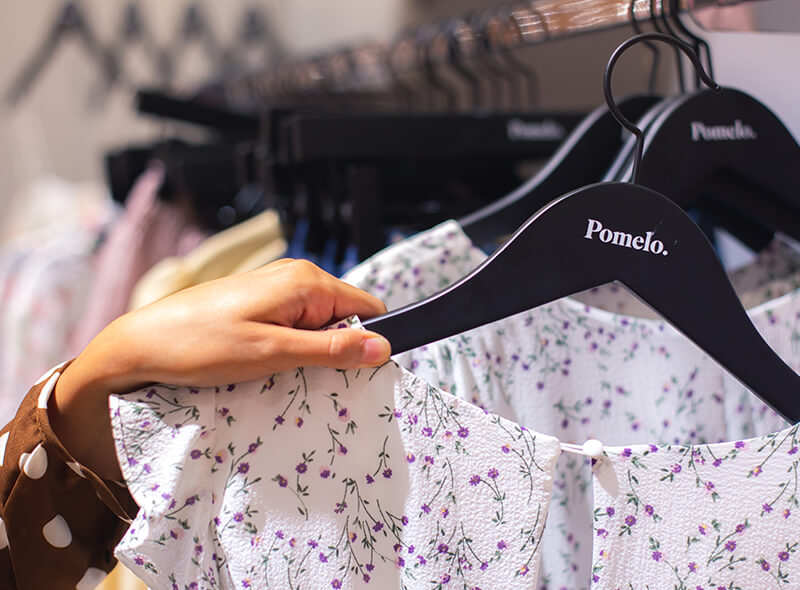
Where is `clothes rod`? clothes rod is located at coordinates (586, 25).